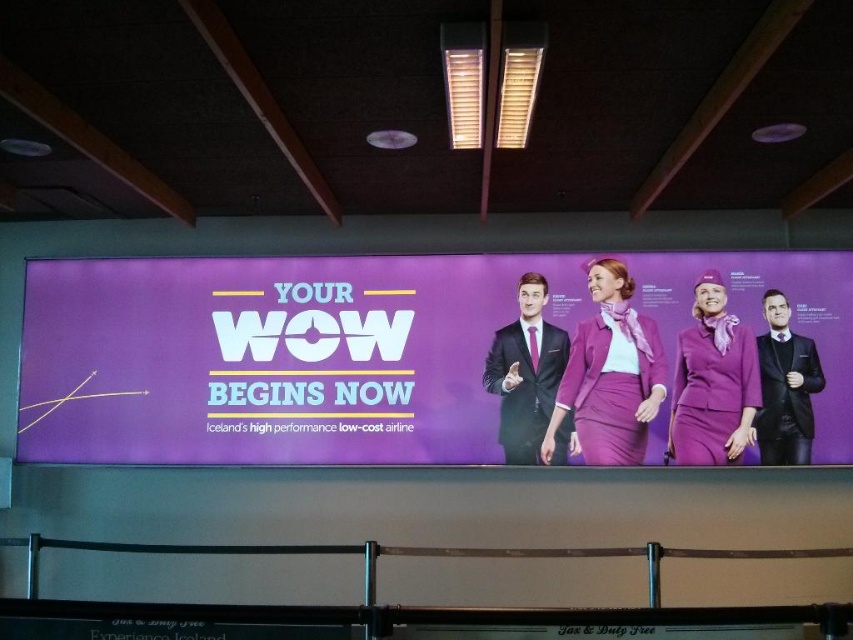
Can you confirm if purple fabric billboard at center is positioned to the right of matte black suit at center?

In fact, purple fabric billboard at center is to the left of matte black suit at center.

What do you see at coordinates (283, 356) in the screenshot? Image resolution: width=853 pixels, height=640 pixels. I see `purple fabric billboard at center` at bounding box center [283, 356].

Find the location of `purple fabric billboard at center`. purple fabric billboard at center is located at coordinates (283, 356).

Who is more forward, (360, 269) or (769, 317)?

Point (769, 317)

Measure the distance between point (368,429) and camera.

5.33 meters

Where is `purple fabric billboard at center`? This screenshot has height=640, width=853. purple fabric billboard at center is located at coordinates (283, 356).

You are a GUI agent. You are given a task and a screenshot of the screen. Output one action in this format:
    pyautogui.click(x=<x>, y=<y>)
    Task: Click on the matte black suit at center
    The height and width of the screenshot is (640, 853).
    Given the screenshot: What is the action you would take?
    pyautogui.click(x=525, y=372)

Who is taller, matte black suit at center or matte black suit at right?

matte black suit at center is taller.

Is point (502, 403) in front of point (751, 438)?

No, it is behind (751, 438).

Locate an element on the screen. Image resolution: width=853 pixels, height=640 pixels. matte black suit at center is located at coordinates (525, 372).